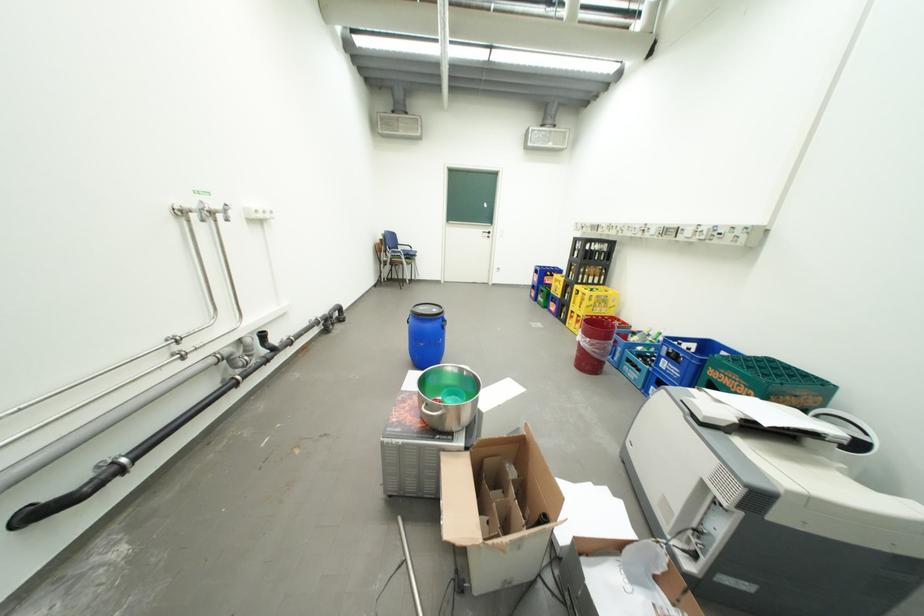
Describe the element at coordinates (427, 310) in the screenshot. Image resolution: width=924 pixels, height=616 pixels. I see `the blue barrel lid` at that location.